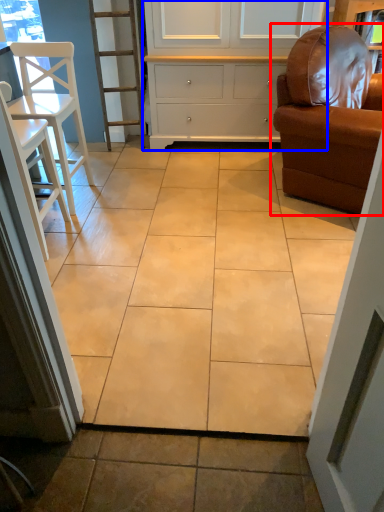
Question: Which of the following is the farthest to the observer, chair (highlighted by a red box) or cabinetry (highlighted by a blue box)?

Choices:
 (A) chair
 (B) cabinetry

Answer: (B)